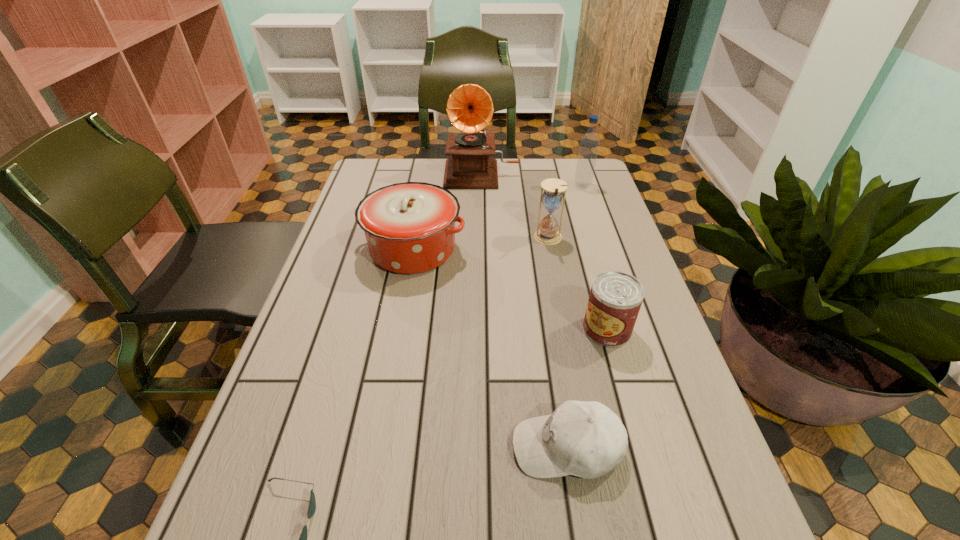
Find the location of `the tallest object`. the tallest object is located at coordinates (469, 108).

I want to click on water bottle, so click(x=589, y=143).

Where is `hourglass`? This screenshot has width=960, height=540. hourglass is located at coordinates (x=547, y=233).

Find the location of a particular element. Image resolution: width=960 pixels, height=540 pixels. casserole is located at coordinates (409, 227).

Where is `the fifth tallest object`? the fifth tallest object is located at coordinates (615, 299).

The height and width of the screenshot is (540, 960). In order to click on the third nearest object in this screenshot , I will do `click(615, 299)`.

Find the location of a particular element. baseball cap is located at coordinates [586, 439].

Image resolution: width=960 pixels, height=540 pixels. Identify the location of vacant space located on the horn of the tallest object. (482, 254).

Locate an element on the screen. Image resolution: width=960 pixels, height=540 pixels. free region located on the left of the water bottle is located at coordinates (492, 186).

What are the coordinates of `free space located 0.350m on the back of the hourglass` in the screenshot? It's located at (535, 168).